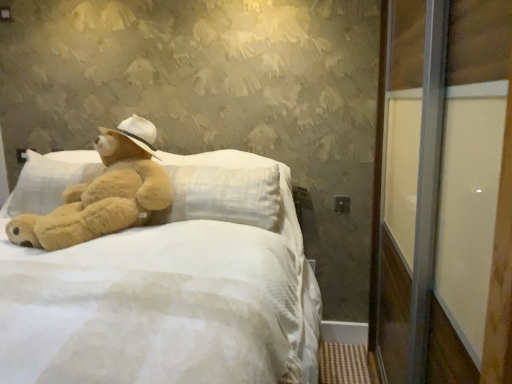
Question: From a real-world perspective, is fuzzy beige teddy bear at left under transparent glass screen door at right?

Choices:
 (A) no
 (B) yes

Answer: (A)

Question: Considering the relative positions of fuzzy beige teddy bear at left and transparent glass screen door at right in the image provided, is fuzzy beige teddy bear at left to the left of transparent glass screen door at right from the viewer's perspective?

Choices:
 (A) no
 (B) yes

Answer: (B)

Question: Does fuzzy beige teddy bear at left appear on the right side of transparent glass screen door at right?

Choices:
 (A) no
 (B) yes

Answer: (A)

Question: Considering the relative sizes of fuzzy beige teddy bear at left and transparent glass screen door at right in the image provided, is fuzzy beige teddy bear at left thinner than transparent glass screen door at right?

Choices:
 (A) yes
 (B) no

Answer: (A)

Question: Is fuzzy beige teddy bear at left taller than transparent glass screen door at right?

Choices:
 (A) no
 (B) yes

Answer: (A)

Question: From a real-world perspective, relative to soft white fabric bed at center, is transparent glass screen door at right vertically above or below?

Choices:
 (A) below
 (B) above

Answer: (B)

Question: Visually, is transparent glass screen door at right positioned to the left or to the right of soft white fabric bed at center?

Choices:
 (A) left
 (B) right

Answer: (B)

Question: Looking at their shapes, would you say transparent glass screen door at right is wider or thinner than soft white fabric bed at center?

Choices:
 (A) thin
 (B) wide

Answer: (A)

Question: Is transparent glass screen door at right taller or shorter than soft white fabric bed at center?

Choices:
 (A) short
 (B) tall

Answer: (B)

Question: In terms of width, does fuzzy beige teddy bear at left look wider or thinner when compared to soft white fabric bed at center?

Choices:
 (A) thin
 (B) wide

Answer: (A)

Question: From their relative heights in the image, would you say fuzzy beige teddy bear at left is taller or shorter than soft white fabric bed at center?

Choices:
 (A) tall
 (B) short

Answer: (B)

Question: Based on their sizes in the image, would you say fuzzy beige teddy bear at left is bigger or smaller than soft white fabric bed at center?

Choices:
 (A) big
 (B) small

Answer: (B)

Question: From the image's perspective, is fuzzy beige teddy bear at left above or below soft white fabric bed at center?

Choices:
 (A) below
 (B) above

Answer: (B)

Question: From the image's perspective, relative to transparent glass screen door at right, is soft white fabric bed at center above or below?

Choices:
 (A) below
 (B) above

Answer: (A)

Question: Is soft white fabric bed at center taller or shorter than transparent glass screen door at right?

Choices:
 (A) tall
 (B) short

Answer: (B)